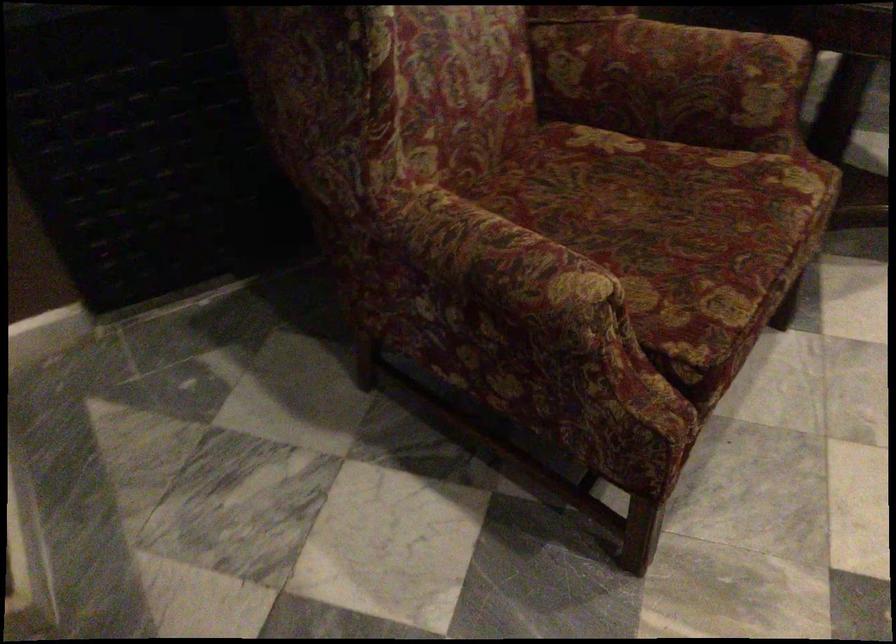
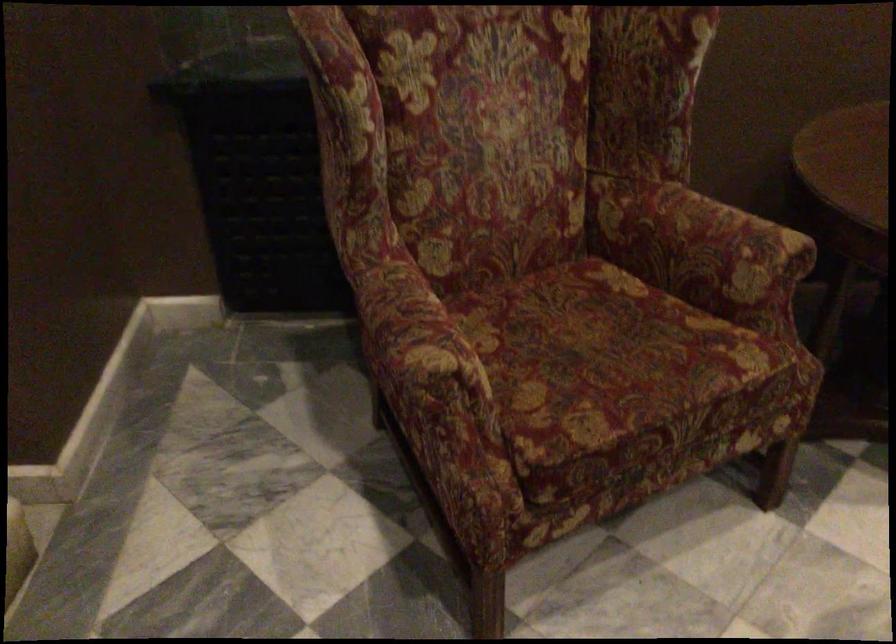
In the second image, find the point that corresponds to pixel 588 308 in the first image.

(428, 377)